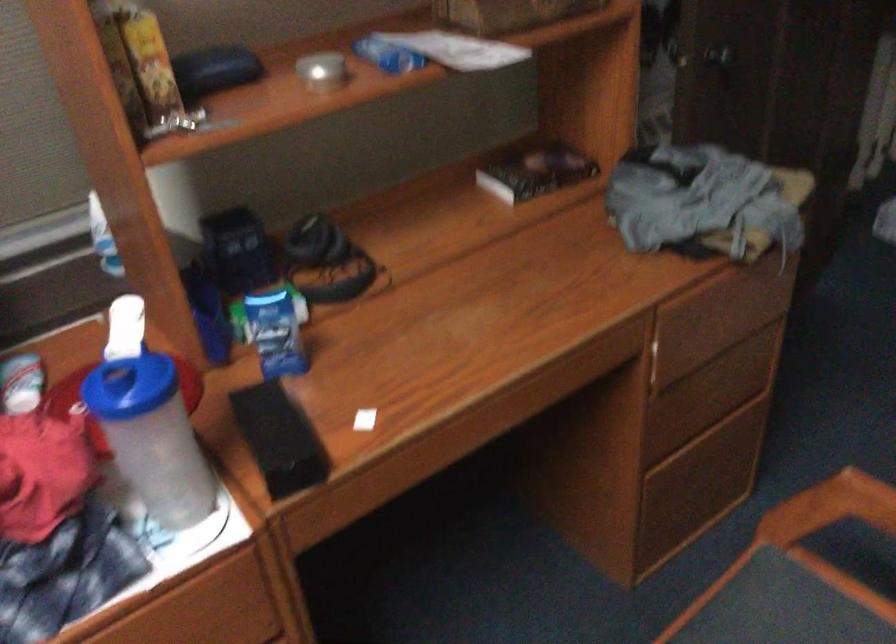
Where would you sit the chair sitting surface? Please return your answer as a coordinate pair (x, y).

(780, 614)